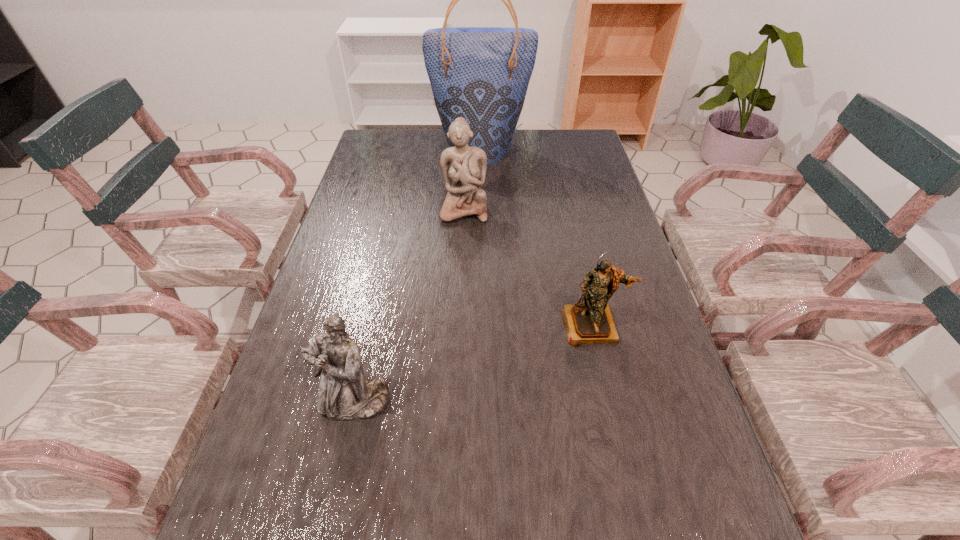
Locate an element on the screen. The image size is (960, 540). figurine that is the third closest to the farthest object is located at coordinates (344, 394).

I want to click on figurine object that ranks as the second closest to the second nearest figurine, so click(x=344, y=394).